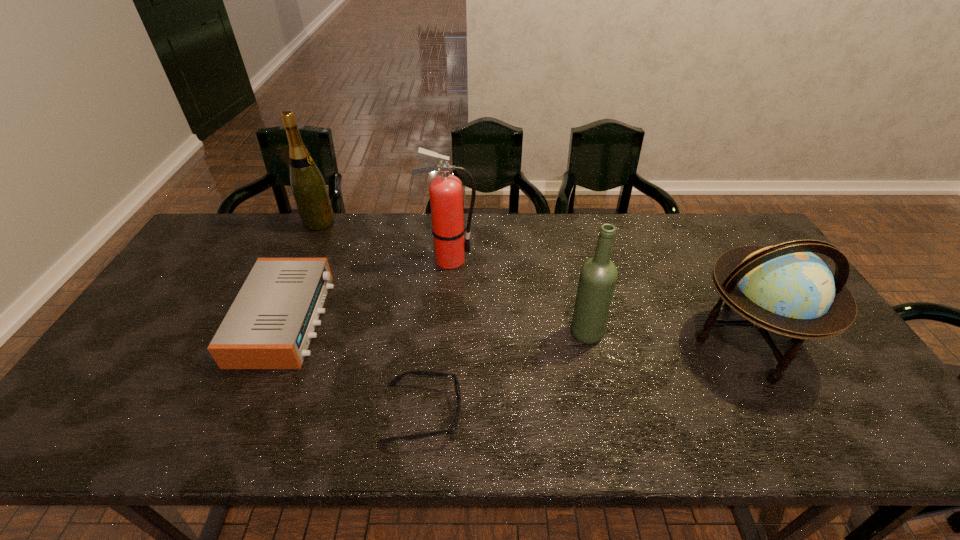
Image resolution: width=960 pixels, height=540 pixels. Identify the location of vacant region at the left edge of the desktop. (180, 349).

This screenshot has width=960, height=540. What are the coordinates of `vacant region at the right edge of the desktop` in the screenshot? It's located at (847, 387).

Find the location of a particular element. The width and height of the screenshot is (960, 540). blank space at the far left corner of the desktop is located at coordinates (239, 256).

Where is `vacant region at the near left corner of the desktop`? vacant region at the near left corner of the desktop is located at coordinates (95, 433).

Locate an element on the screen. The height and width of the screenshot is (540, 960). free space at the near right corner of the desktop is located at coordinates (850, 421).

Where is `empty space between the farthest object and the right wine bottle`? This screenshot has height=540, width=960. empty space between the farthest object and the right wine bottle is located at coordinates (452, 278).

Where is `free space between the right wine bottle and the second shortest object`? free space between the right wine bottle and the second shortest object is located at coordinates pos(436,326).

Identify the location of free space that is in between the radio receiver and the spectacles. (354, 366).

Identify the location of free space between the left wine bottle and the nearer wine bottle. (452, 278).

This screenshot has width=960, height=540. I want to click on vacant area that lies between the spectacles and the second shortest object, so click(x=354, y=366).